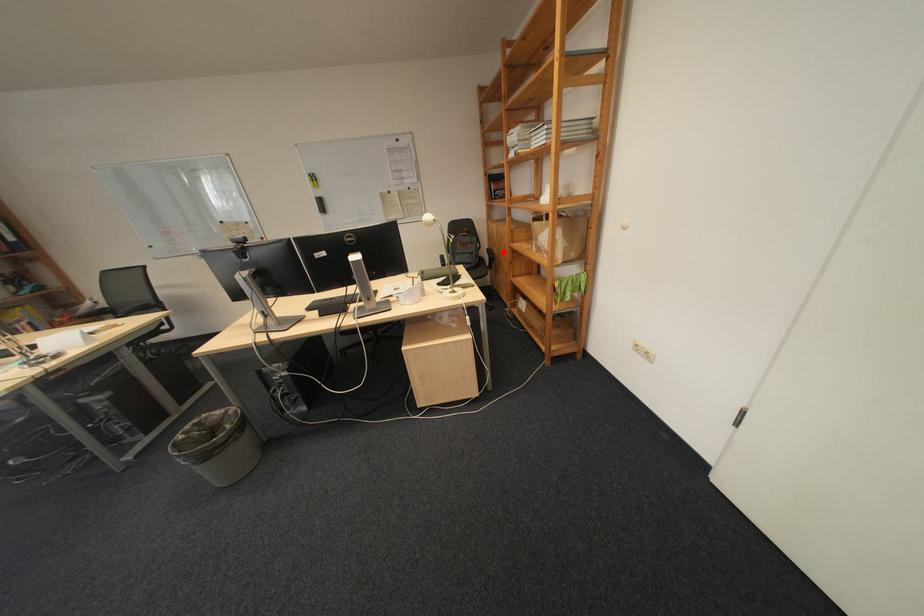
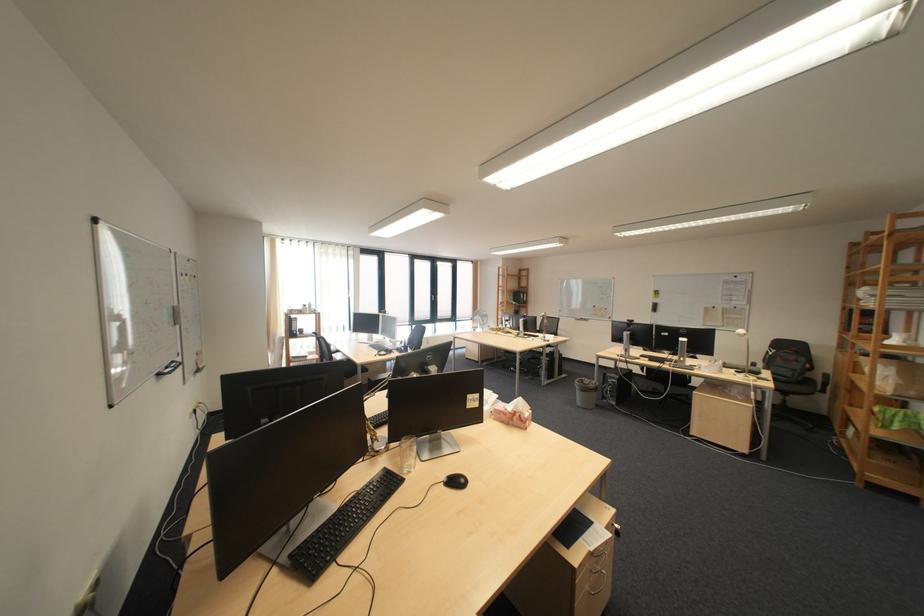
The point at the highlighted location is marked in the first image. Where is the corresponding point in the second image?

(841, 377)